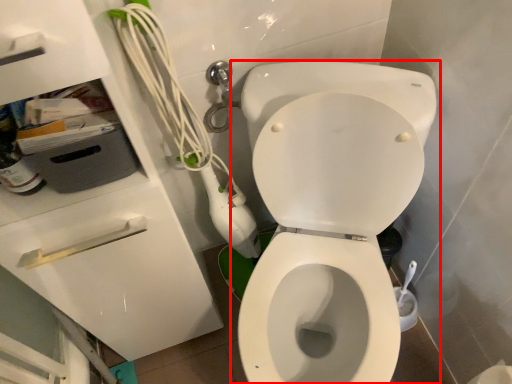
Question: Considering the relative positions of toilet (annotated by the red box) and drawer in the image provided, where is toilet (annotated by the red box) located with respect to the staircase?

Choices:
 (A) right
 (B) left

Answer: (A)